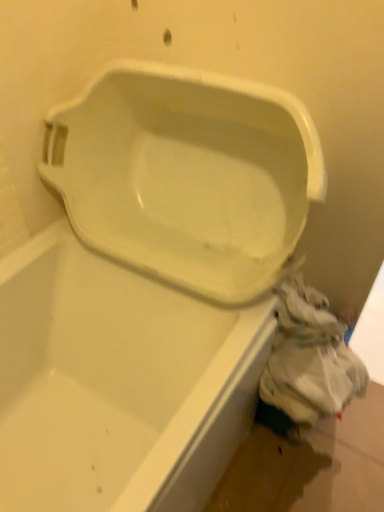
Find the location of a particular element. white fabric bag at lower right is located at coordinates (307, 362).

Describe the element at coordinates (307, 362) in the screenshot. I see `white fabric bag at lower right` at that location.

In order to face white fabric bag at lower right, should I rotate leftwards or rightwards?

Rotate right and turn 15.858 degrees.

This screenshot has height=512, width=384. Identify the location of white fabric bag at lower right. click(x=307, y=362).